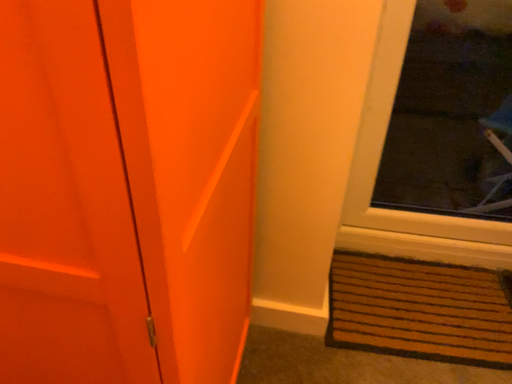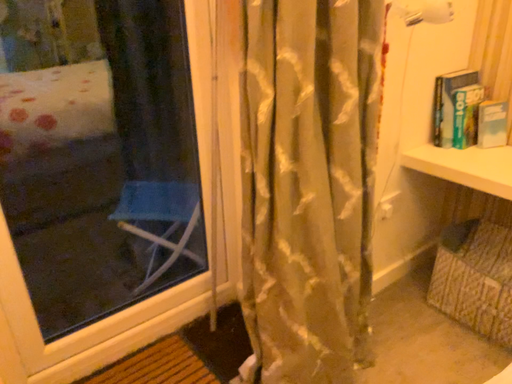
Question: How did the camera likely rotate when shooting the video?

Choices:
 (A) rotated left
 (B) rotated right

Answer: (B)